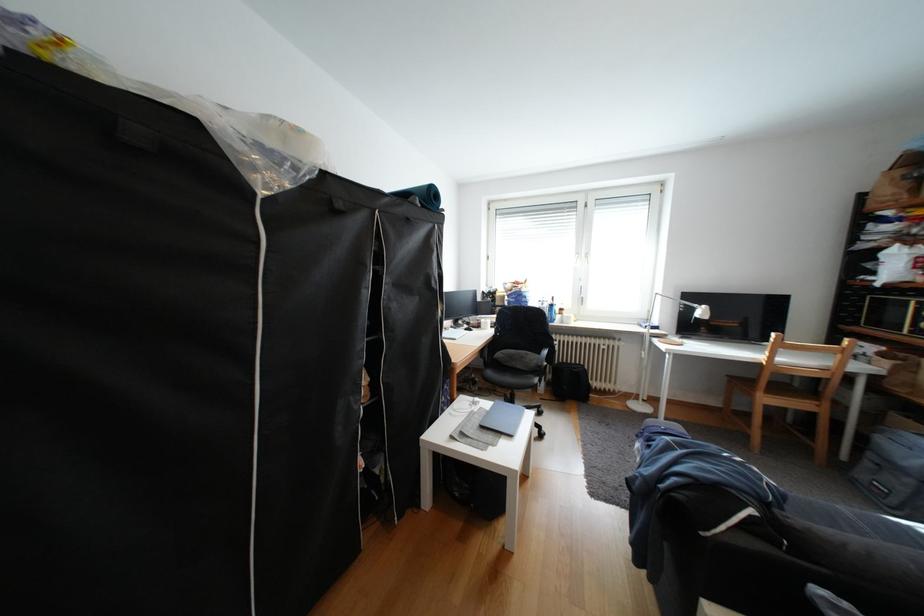
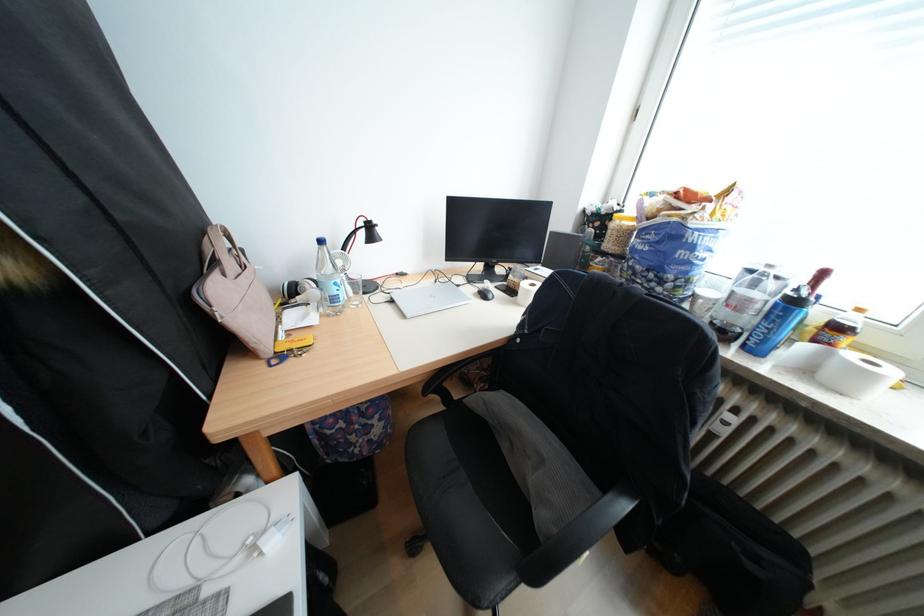
The point at (564, 306) is marked in the first image. Where is the corresponding point in the second image?

(808, 302)